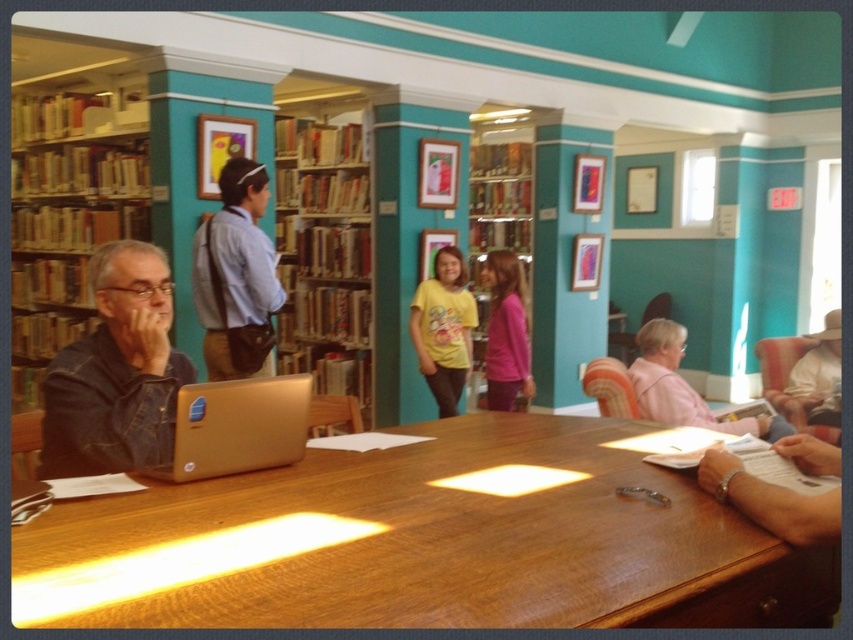
Looking at this image, does brown wooden bookcase at left appear over pink matte shirt at center?

Yes, brown wooden bookcase at left is above pink matte shirt at center.

Which is in front, point (15, 288) or point (514, 305)?

Point (514, 305) is in front.

You are a GUI agent. You are given a task and a screenshot of the screen. Output one action in this format:
    pyautogui.click(x=<x>, y=<y>)
    Task: Click on the brown wooden bookcase at left
    
    Given the screenshot: What is the action you would take?
    pyautogui.click(x=65, y=221)

Does brown wooden bookcase at left appear on the right side of matte wood bookshelf at center?

Incorrect, brown wooden bookcase at left is not on the right side of matte wood bookshelf at center.

Can you confirm if brown wooden bookcase at left is wider than matte wood bookshelf at center?

Yes, brown wooden bookcase at left is wider than matte wood bookshelf at center.

The image size is (853, 640). What do you see at coordinates (65, 221) in the screenshot?
I see `brown wooden bookcase at left` at bounding box center [65, 221].

Locate an element on the screen. The image size is (853, 640). brown wooden bookcase at left is located at coordinates (65, 221).

Can you confirm if brown wooden bookcase at left is thinner than gold metallic laptop at center?

No.

Which is behind, point (35, 244) or point (242, 429)?

The point (35, 244) is behind.

Locate an element on the screen. This screenshot has height=640, width=853. brown wooden bookcase at left is located at coordinates (65, 221).